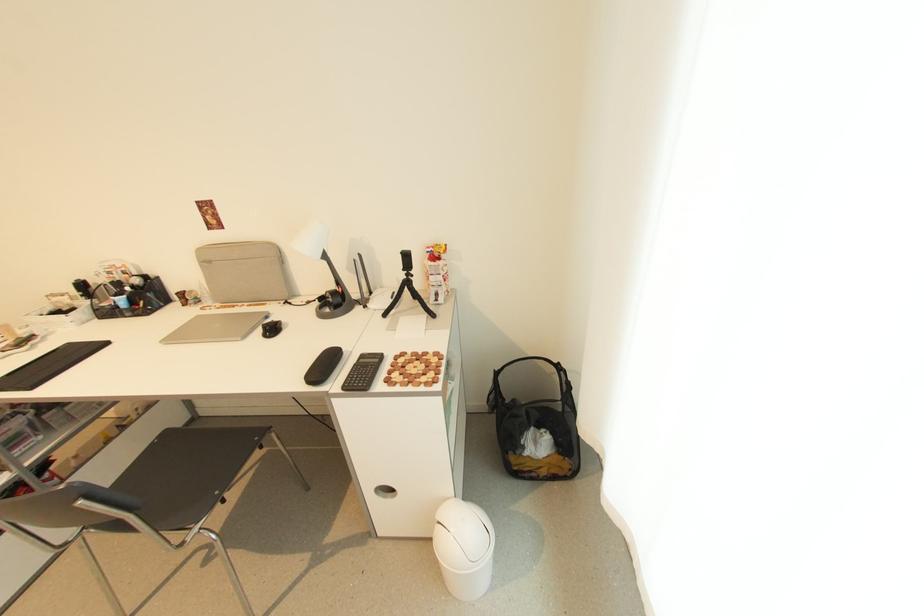
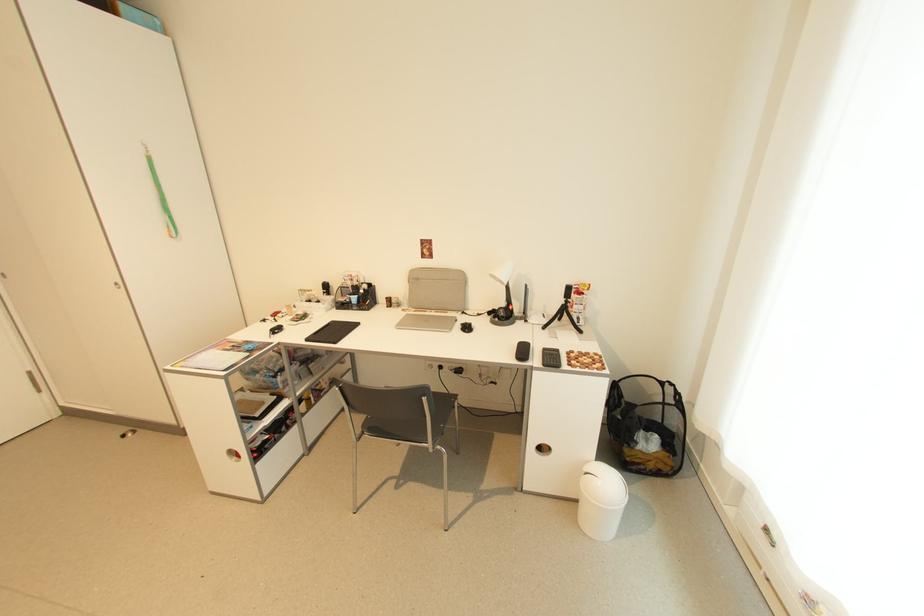
Where in the second image is the point corresponding to pixel 531 455 from the first image?

(642, 450)